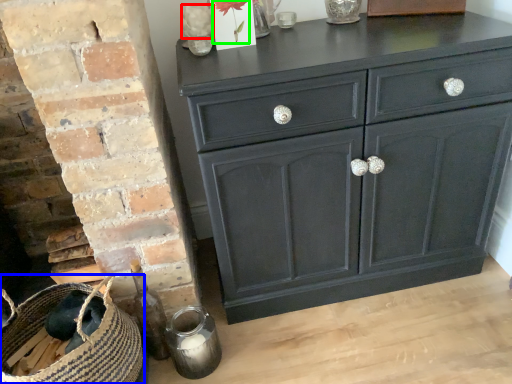
Question: Which is farther away from flower (highlighted by a red box)? basket (highlighted by a blue box) or flower (highlighted by a green box)?

Choices:
 (A) basket
 (B) flower

Answer: (A)